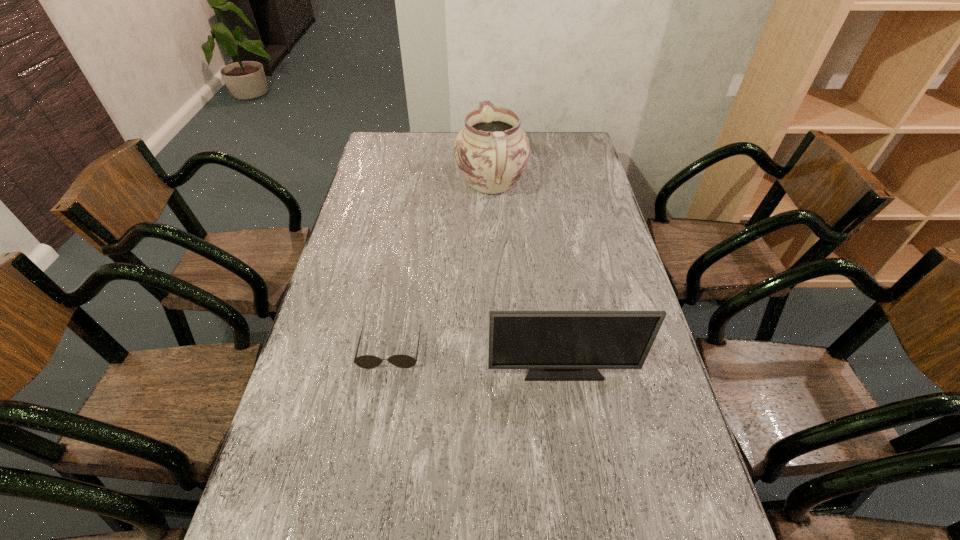
Find the location of a particular element. This screenshot has height=540, width=960. object at the left edge is located at coordinates (366, 361).

The width and height of the screenshot is (960, 540). In order to click on object situated at the right edge in this screenshot , I will do `click(554, 345)`.

Locate an element on the screen. The image size is (960, 540). free point at the left edge is located at coordinates (373, 282).

The image size is (960, 540). In order to click on vacant space at the right edge of the desktop in this screenshot , I will do `click(588, 237)`.

The width and height of the screenshot is (960, 540). I want to click on vacant point at the far right corner, so click(x=551, y=142).

The height and width of the screenshot is (540, 960). I want to click on vacant space in between the leftmost object and the farthest object, so click(x=441, y=267).

Where is `free space between the pitcher and the shortest object`? free space between the pitcher and the shortest object is located at coordinates coord(441,267).

Locate an element on the screen. The width and height of the screenshot is (960, 540). free space between the sunglasses and the monitor is located at coordinates (476, 359).

Identify the location of empty space between the shortest object and the monitor. (476, 359).

Locate an element on the screen. This screenshot has width=960, height=540. vacant region between the monitor and the farthest object is located at coordinates (527, 276).